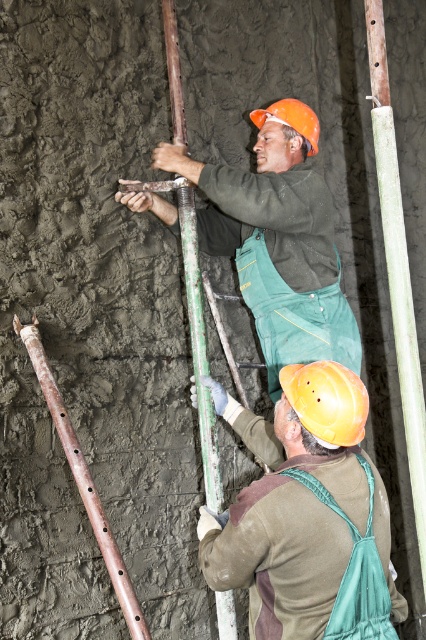
You are a safety inspector observing the construction site. You notice the matte yellow hard hat at center and the smooth green pole at right. Which object is shorter?

The matte yellow hard hat at center is shorter than the smooth green pole at right.

You are a safety inspector observing the construction site. You notice the matte yellow hard hat at center and the rusty metal pole at center. Which object is closer to you?

The matte yellow hard hat at center is closer to you because it is in front of the rusty metal pole at center.

You are a safety inspector with a 2 meter measuring tape. You need to check the distance between the smooth green pole at right and the camera. Can you accurately measure it with your tape?

The smooth green pole at right is 1.99 meters away from camera, so yes, the inspector can measure it with the 2 meter tape since the distance is just under 2 meters.